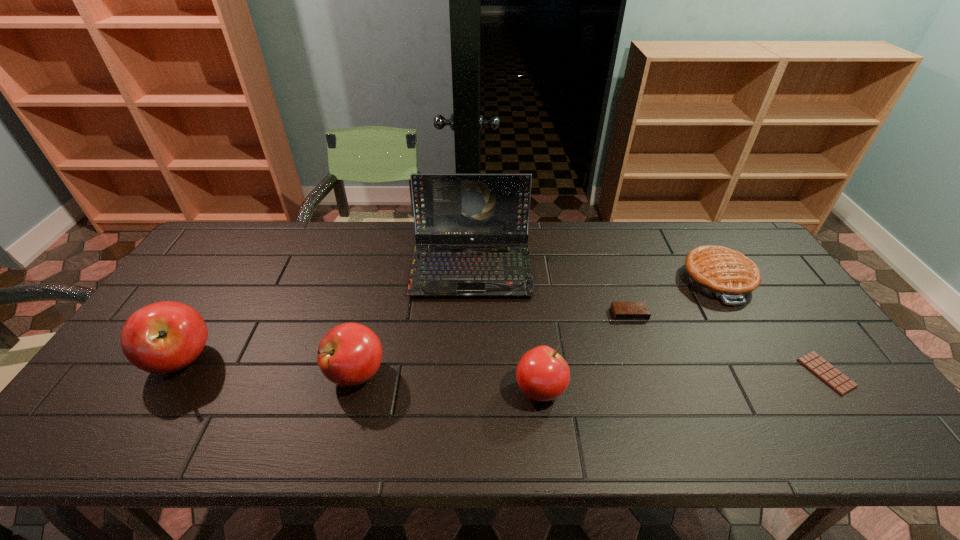
Find the location of a particular element. empty space that is in between the candy bar and the rightmost apple is located at coordinates (684, 381).

Where is `vacant space that is in between the leftmost object and the candy bar`? The image size is (960, 540). vacant space that is in between the leftmost object and the candy bar is located at coordinates (504, 366).

I want to click on object that ranks as the fourth closest to the fifth tallest object, so click(542, 374).

Locate which object ranks third in proximity to the third shortest object. Please provide its 2D coordinates. Your answer should be formatted as a tuple, i.e. [(x, y)], where the tuple contains the x and y coordinates of a point satisfying the conditions above.

[(449, 208)]

Where is `apple that is the second closest to the candy bar`? This screenshot has height=540, width=960. apple that is the second closest to the candy bar is located at coordinates (350, 354).

Locate which apple is the second closest to the fourth shortest object. Please provide its 2D coordinates. Your answer should be formatted as a tuple, i.e. [(x, y)], where the tuple contains the x and y coordinates of a point satisfying the conditions above.

[(163, 337)]

Find the location of `free space that satisfies the following two spatial constraints: 1. on the screen of the laptop computer; 2. on the right side of the candy bar`. free space that satisfies the following two spatial constraints: 1. on the screen of the laptop computer; 2. on the right side of the candy bar is located at coordinates (x=469, y=373).

Find the location of `vacant space that satisfies the following two spatial constraints: 1. on the back side of the sixth object from right to left; 2. on the left side of the fifth tallest object`. vacant space that satisfies the following two spatial constraints: 1. on the back side of the sixth object from right to left; 2. on the left side of the fifth tallest object is located at coordinates (379, 279).

Where is `free space that satisfies the following two spatial constraints: 1. on the back side of the leftmost object; 2. on the right side of the fifth tallest object`? This screenshot has height=540, width=960. free space that satisfies the following two spatial constraints: 1. on the back side of the leftmost object; 2. on the right side of the fifth tallest object is located at coordinates (232, 279).

You are a GUI agent. You are given a task and a screenshot of the screen. Output one action in this format:
    pyautogui.click(x=<x>, y=<y>)
    Task: Click on the vacant space that satisfies the following two spatial constraints: 1. on the screen of the tallest object; 2. on the right side of the fifth tallest object
    The image size is (960, 540).
    Given the screenshot: What is the action you would take?
    pyautogui.click(x=471, y=279)